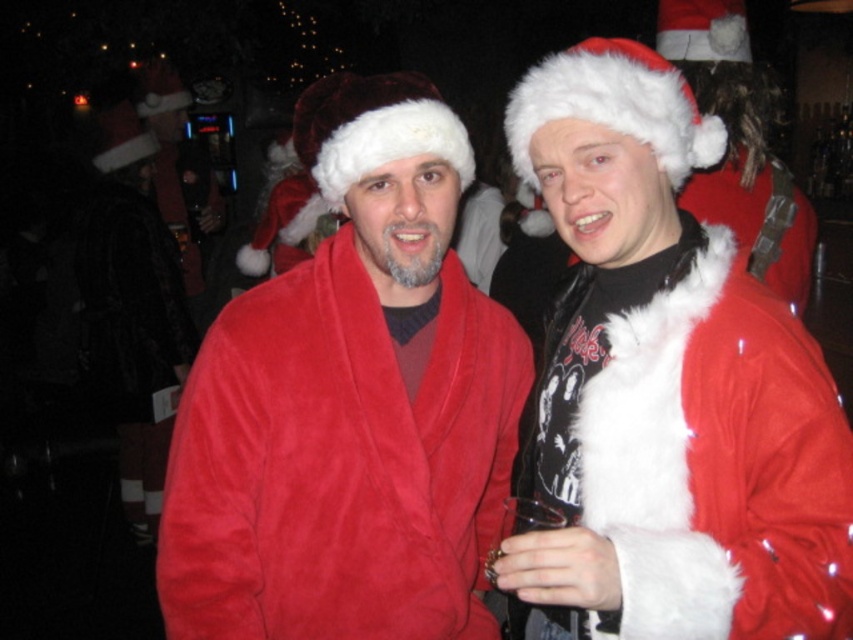
Question: Can you confirm if matte red robe at center is positioned to the right of fuzzy red coat at right?

Choices:
 (A) yes
 (B) no

Answer: (B)

Question: Is matte red robe at center in front of fuzzy red robe at right?

Choices:
 (A) yes
 (B) no

Answer: (B)

Question: Which of the following is the farthest from the observer?

Choices:
 (A) matte red robe at center
 (B) fuzzy red robe at right
 (C) fuzzy red coat at right

Answer: (C)

Question: Which object is positioned farthest from the fuzzy red robe at right?

Choices:
 (A) matte red robe at center
 (B) fuzzy red coat at right

Answer: (B)

Question: Does fuzzy red robe at right have a smaller size compared to fuzzy red coat at right?

Choices:
 (A) yes
 (B) no

Answer: (A)

Question: Which point appears farthest from the camera in this image?

Choices:
 (A) (683, 518)
 (B) (277, 632)
 (C) (657, 35)

Answer: (C)